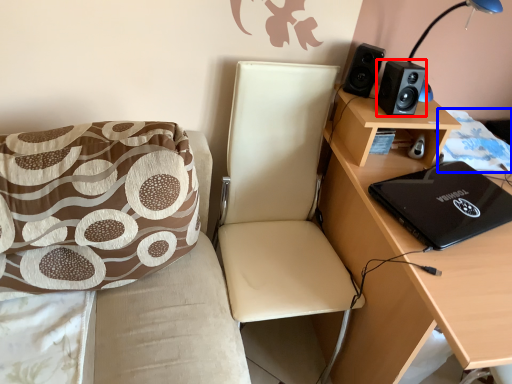
Question: Which of the following is the closest to the observer, speaker (highlighted by a red box) or quilt (highlighted by a blue box)?

Choices:
 (A) speaker
 (B) quilt

Answer: (A)